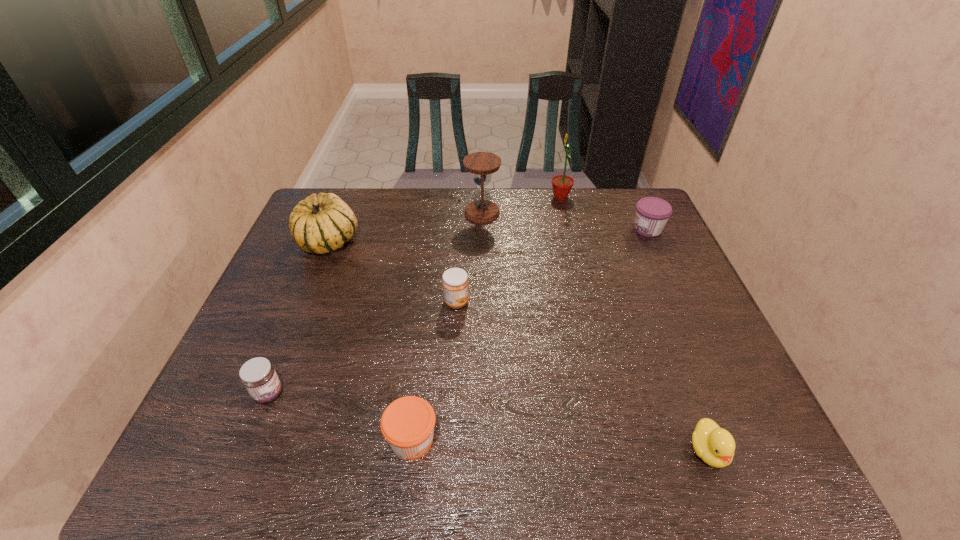
Locate an element on the screen. blank space located 0.350m on the face of the sunflower is located at coordinates (449, 197).

Where is `vacant space located on the face of the sunflower`? This screenshot has width=960, height=540. vacant space located on the face of the sunflower is located at coordinates 469,197.

This screenshot has width=960, height=540. Find the location of `vacant area situated on the face of the sunflower`. vacant area situated on the face of the sunflower is located at coordinates (521, 197).

This screenshot has width=960, height=540. In order to click on vacant space situated 0.290m on the front of the hourglass in this screenshot , I will do pyautogui.click(x=483, y=286).

Find the location of a particular element. The width and height of the screenshot is (960, 540). vacant area situated on the right of the third tallest object is located at coordinates (389, 241).

Where is `vacant region located 0.180m on the front label of the second farthest jam`? Image resolution: width=960 pixels, height=540 pixels. vacant region located 0.180m on the front label of the second farthest jam is located at coordinates (537, 302).

Where is `free spot located 0.320m on the front label of the leftmost jam`? free spot located 0.320m on the front label of the leftmost jam is located at coordinates (429, 394).

The height and width of the screenshot is (540, 960). What are the coordinates of `vacant space situated on the front label of the rightmost jam` in the screenshot? It's located at (518, 229).

Identify the location of free space located on the front label of the rightmost jam. This screenshot has width=960, height=540. (549, 229).

The image size is (960, 540). What are the coordinates of `vacant space located on the front label of the rightmost jam` in the screenshot? It's located at (518, 229).